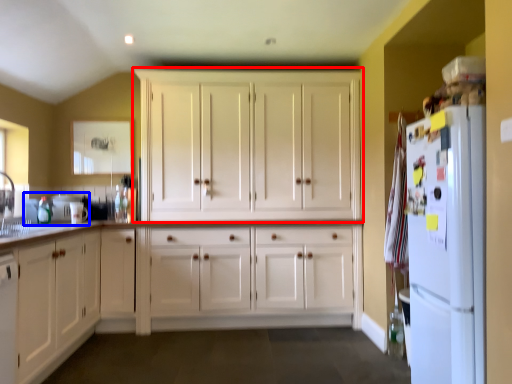
Question: Which point is closer to the camera, cabinetry (highlighted by a red box) or sink (highlighted by a blue box)?

Choices:
 (A) cabinetry
 (B) sink

Answer: (A)